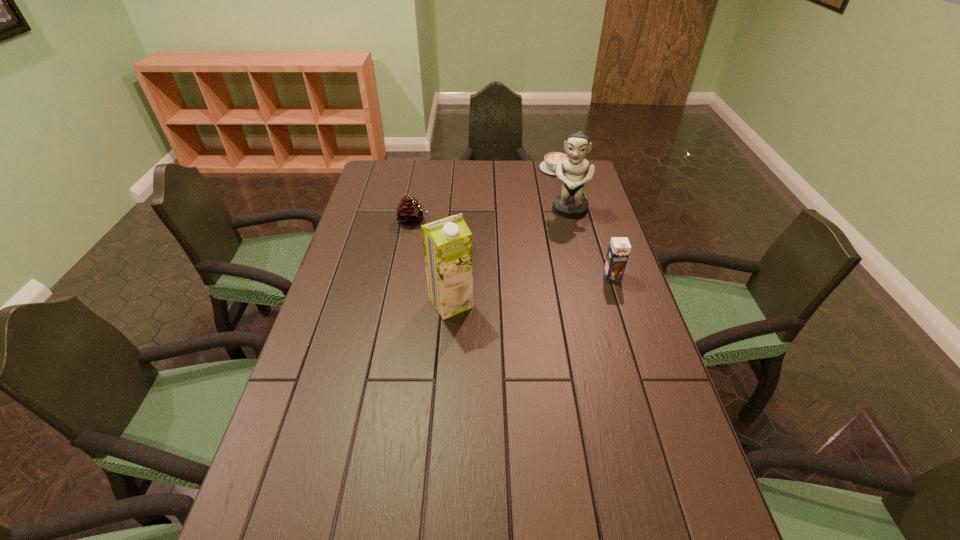
Identify the location of the second object from left to right. (447, 243).

Locate an element on the screen. the nearest object is located at coordinates (447, 243).

Find the location of a particular element. Image resolution: width=960 pixels, height=540 pixels. the third shortest object is located at coordinates [619, 249].

Where is `chocolate milk`? Image resolution: width=960 pixels, height=540 pixels. chocolate milk is located at coordinates (619, 249).

At what (x,y) coordinates should I click in order to perform the action: click on figurine. Please return your answer as a coordinate pair (x, y). The width and height of the screenshot is (960, 540). Looking at the image, I should click on (571, 203).

The height and width of the screenshot is (540, 960). What are the coordinates of `the farthest object` in the screenshot? It's located at (551, 159).

I want to click on cappuccino, so click(x=551, y=159).

The width and height of the screenshot is (960, 540). What are the coordinates of `the fourth tallest object` in the screenshot? It's located at (410, 212).

Where is `pinecone`? This screenshot has height=540, width=960. pinecone is located at coordinates (410, 212).

In order to click on vacant region located on the right of the nearest object in this screenshot , I will do `click(603, 303)`.